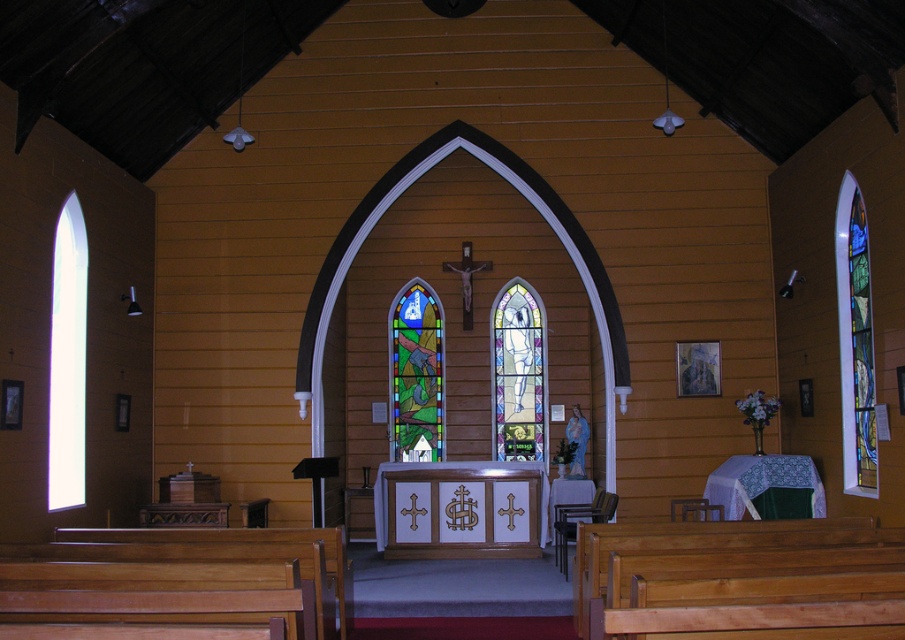
Who is positioned more to the right, transparent glass window at left or stained glass window at center?

stained glass window at center

Image resolution: width=905 pixels, height=640 pixels. What do you see at coordinates (67, 362) in the screenshot?
I see `transparent glass window at left` at bounding box center [67, 362].

This screenshot has height=640, width=905. I want to click on transparent glass window at left, so coord(67,362).

Which is below, stained glass window at right or stained glass window at center?

Positioned lower is stained glass window at center.

Does stained glass window at right have a lesser width compared to stained glass window at center?

Correct, stained glass window at right's width is less than stained glass window at center's.

Consider the image. Who is more forward, (853, 264) or (424, 356)?

Point (853, 264) is in front.

The height and width of the screenshot is (640, 905). What are the coordinates of `stained glass window at right` in the screenshot? It's located at (855, 342).

Who is taller, light brown wooden bench at lower right or stained glass window at center?

With more height is stained glass window at center.

Between point (679, 538) and point (399, 385), which one is positioned behind?

Positioned behind is point (399, 385).

The width and height of the screenshot is (905, 640). I want to click on light brown wooden bench at lower right, so click(x=749, y=580).